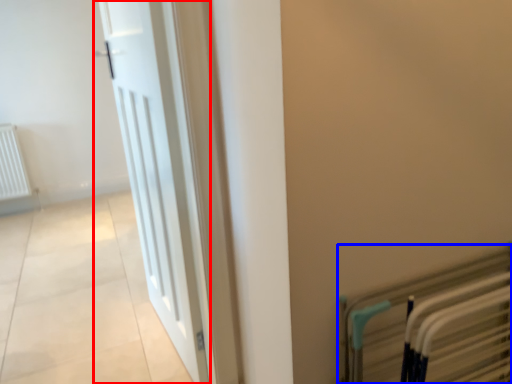
Question: Among these objects, which one is farthest to the camera, door (highlighted by a red box) or bed frame (highlighted by a blue box)?

Choices:
 (A) door
 (B) bed frame

Answer: (A)